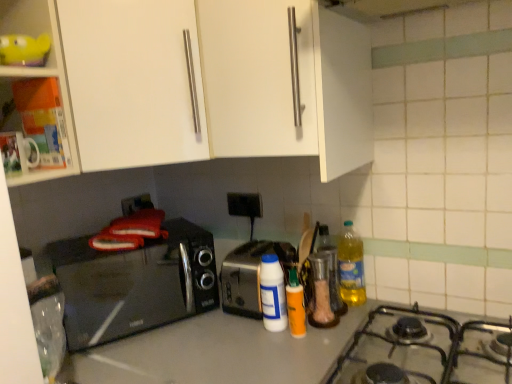
At what (x,y) coordinates should I click in order to perform the action: click on free space in front of white plastic bottle at center, which ranks as the third bottle in right-to-left order. Please return your answer as a coordinate pair (x, y). Image resolution: width=512 pixels, height=384 pixels. Looking at the image, I should click on (271, 353).